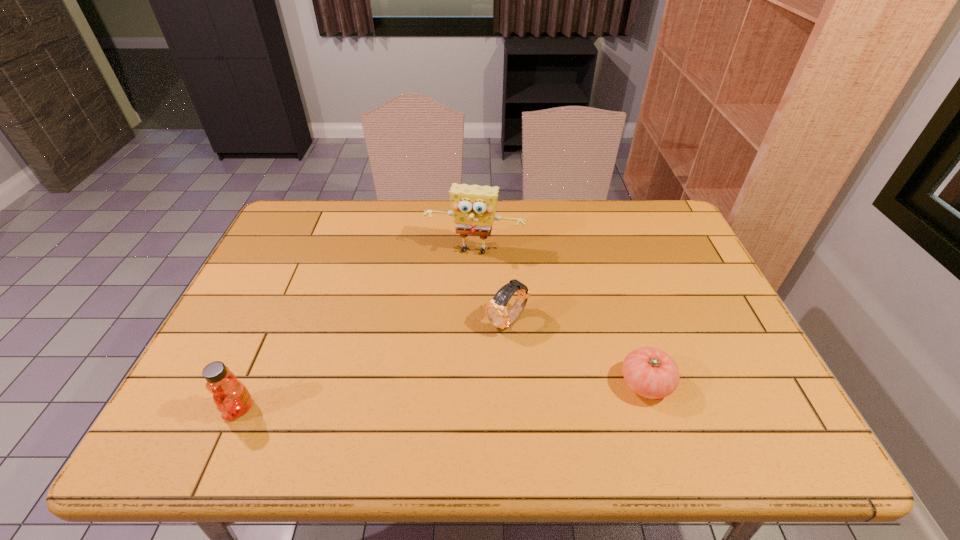
You are a GUI agent. You are given a task and a screenshot of the screen. Output one action in this format:
    pyautogui.click(x=<x>, y=<y>)
    Task: Click on the vacant space on the desktop that is between the leftmost object and the tomato and is positioned on the face of the watch
    This screenshot has height=540, width=960.
    Given the screenshot: What is the action you would take?
    pyautogui.click(x=421, y=397)

Where is `vacant space on the desktop that is between the honey and the rightmost object and is positioned on the face of the tallest object`? Image resolution: width=960 pixels, height=540 pixels. vacant space on the desktop that is between the honey and the rightmost object and is positioned on the face of the tallest object is located at coordinates (439, 396).